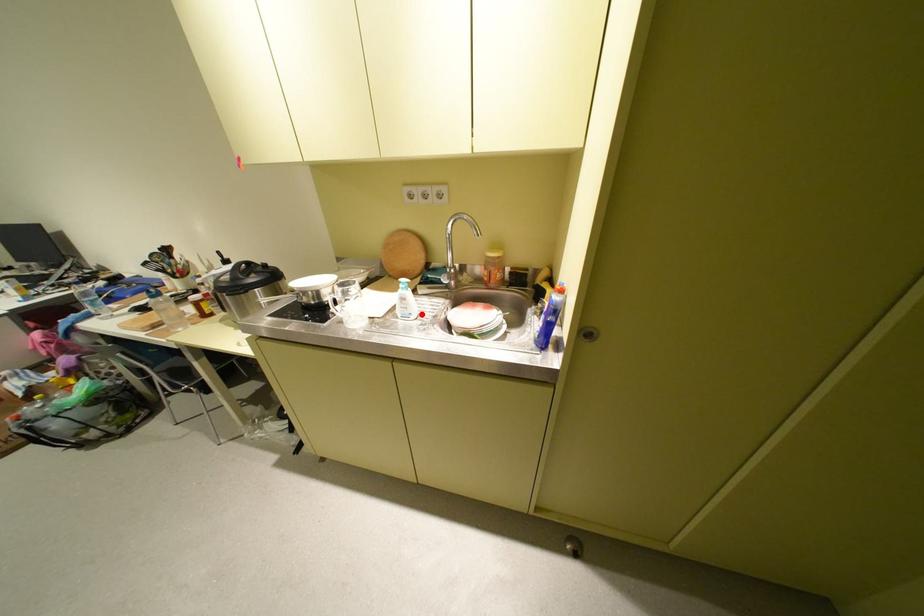
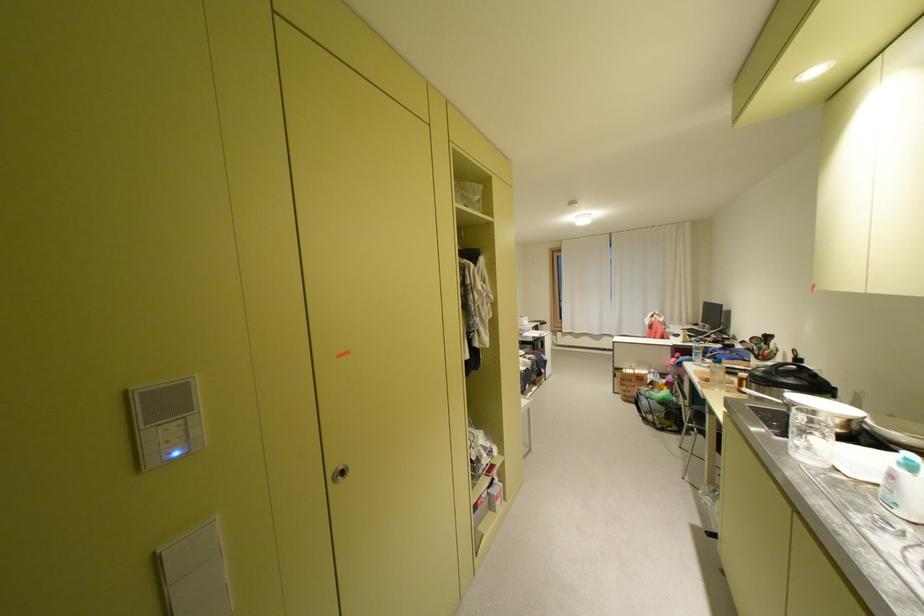
The point at the highlighted location is marked in the first image. Where is the corresponding point in the second image?

(906, 505)